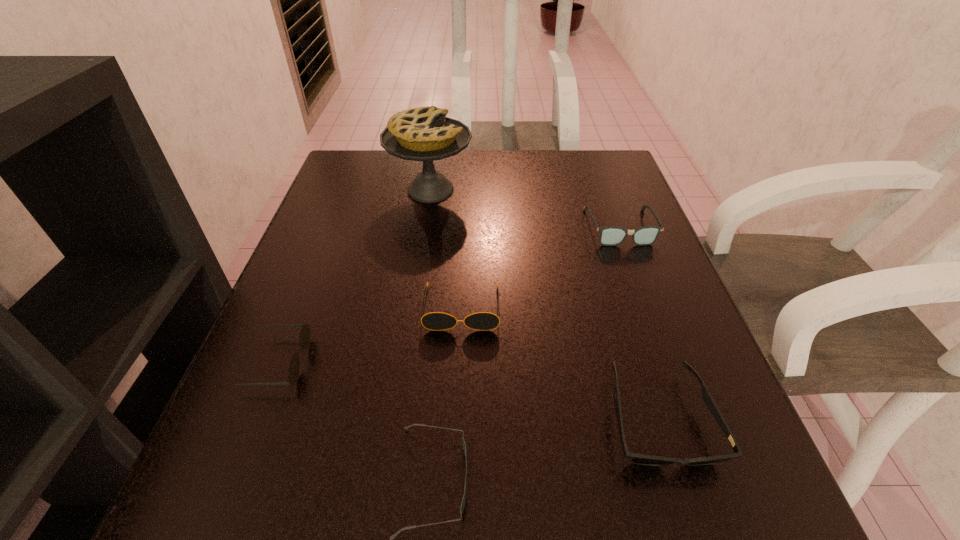
The image size is (960, 540). I want to click on empty location between the pie and the rightmost sunglasses, so click(544, 305).

Identify which object is located as the fourth nearest to the shortest sunglasses. Please provide its 2D coordinates. Your answer should be formatted as a tuple, i.e. [(x, y)], where the tuple contains the x and y coordinates of a point satisfying the conditions above.

[(609, 236)]

Locate which object ranks fifth in proximity to the spectacles. Please provide its 2D coordinates. Your answer should be formatted as a tuple, i.e. [(x, y)], where the tuple contains the x and y coordinates of a point satisfying the conditions above.

[(304, 339)]

The height and width of the screenshot is (540, 960). In order to click on sunglasses that is the second closest one to the third farthest object in this screenshot , I will do `click(393, 536)`.

Identify the location of sunglasses that is the second closest to the leftmost sunglasses. (393, 536).

Find the location of a particular element. The width and height of the screenshot is (960, 540). blank area in the image that satisfies the following two spatial constraints: 1. on the face of the spectacles; 2. on the front-facing side of the leftmost object is located at coordinates tap(669, 362).